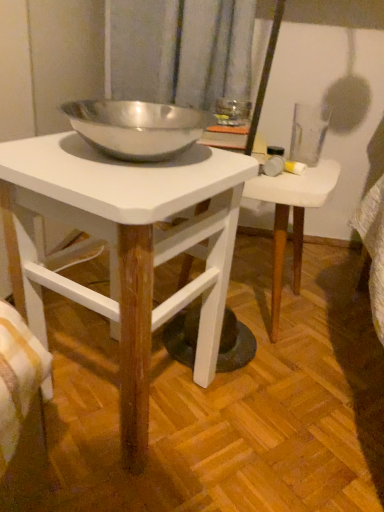
Question: Should I look upward or downward to see white wood table at center, which is the first table in back-to-front order?

Choices:
 (A) down
 (B) up

Answer: (B)

Question: Is white matte table at center, which is the first table from front to back, not close to white wood table at center, positioned as the second table in front-to-back order?

Choices:
 (A) yes
 (B) no

Answer: (B)

Question: Considering the relative positions of white matte table at center, which is counted as the 2th table, starting from the back, and white wood table at center, positioned as the second table in front-to-back order, in the image provided, is white matte table at center, which is counted as the 2th table, starting from the back, to the left of white wood table at center, positioned as the second table in front-to-back order, from the viewer's perspective?

Choices:
 (A) no
 (B) yes

Answer: (B)

Question: Considering the relative sizes of white matte table at center, which is the first table from front to back, and white wood table at center, positioned as the second table in front-to-back order, in the image provided, is white matte table at center, which is the first table from front to back, wider than white wood table at center, positioned as the second table in front-to-back order,?

Choices:
 (A) yes
 (B) no

Answer: (A)

Question: Does white matte table at center, which is the first table from front to back, come behind white wood table at center, positioned as the second table in front-to-back order?

Choices:
 (A) yes
 (B) no

Answer: (B)

Question: From a real-world perspective, is white matte table at center, which is the first table from front to back, on top of white wood table at center, which is the first table in back-to-front order?

Choices:
 (A) no
 (B) yes

Answer: (B)

Question: Is white matte table at center, which is counted as the 2th table, starting from the back, facing towards white wood table at center, which is the first table in back-to-front order?

Choices:
 (A) yes
 (B) no

Answer: (B)

Question: Is there a large distance between white wood table at center, which is the first table in back-to-front order, and white matte table at center, which is the first table from front to back?

Choices:
 (A) yes
 (B) no

Answer: (B)

Question: Is the depth of white wood table at center, positioned as the second table in front-to-back order, greater than that of white matte table at center, which is the first table from front to back?

Choices:
 (A) yes
 (B) no

Answer: (A)

Question: Is white wood table at center, positioned as the second table in front-to-back order, next to white matte table at center, which is counted as the 2th table, starting from the back, and touching it?

Choices:
 (A) no
 (B) yes

Answer: (A)

Question: From a real-world perspective, is white wood table at center, positioned as the second table in front-to-back order, under white matte table at center, which is the first table from front to back?

Choices:
 (A) yes
 (B) no

Answer: (A)

Question: Is white wood table at center, which is the first table in back-to-front order, positioned beyond the bounds of white matte table at center, which is counted as the 2th table, starting from the back?

Choices:
 (A) no
 (B) yes

Answer: (B)

Question: Could you tell me if white wood table at center, positioned as the second table in front-to-back order, is turned towards white matte table at center, which is counted as the 2th table, starting from the back?

Choices:
 (A) no
 (B) yes

Answer: (A)

Question: In terms of width, does white matte table at center, which is counted as the 2th table, starting from the back, look wider or thinner when compared to white wood table at center, positioned as the second table in front-to-back order?

Choices:
 (A) thin
 (B) wide

Answer: (B)